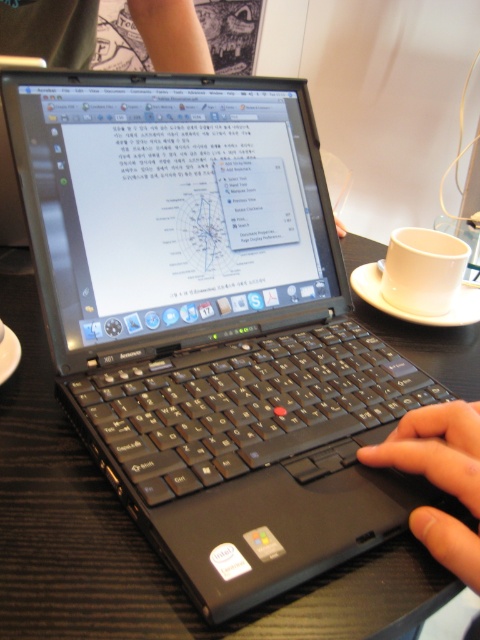
Question: Is black matte hand at lower right thinner than white ceramic cup at right?

Choices:
 (A) yes
 (B) no

Answer: (A)

Question: Which object appears farthest from the camera in this image?

Choices:
 (A) white ceramic cup at right
 (B) black matte hand at lower right

Answer: (A)

Question: Which of these objects is positioned farthest from the black matte hand at lower right?

Choices:
 (A) white ceramic cup at right
 (B) white ceramic saucer at right

Answer: (B)

Question: Which of the following is the farthest from the observer?

Choices:
 (A) (440, 474)
 (B) (408, 316)
 (C) (420, 284)

Answer: (B)

Question: Can you confirm if white ceramic cup at right is positioned to the left of white ceramic saucer at right?

Choices:
 (A) no
 (B) yes

Answer: (B)

Question: From the image, what is the correct spatial relationship of black matte hand at lower right in relation to white ceramic cup at right?

Choices:
 (A) below
 (B) above

Answer: (A)